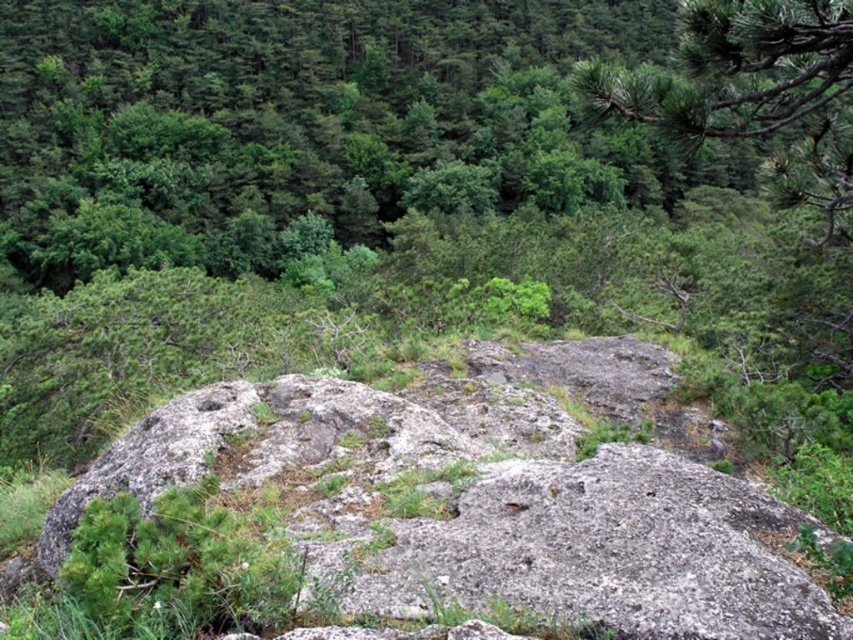
Question: Is gray rough rock at center wider than green needle-like at upper right?

Choices:
 (A) yes
 (B) no

Answer: (B)

Question: Does gray rough rock at center appear under green needle-like at upper right?

Choices:
 (A) no
 (B) yes

Answer: (B)

Question: Considering the relative positions of gray rough rock at center and green needle-like at upper right in the image provided, where is gray rough rock at center located with respect to green needle-like at upper right?

Choices:
 (A) left
 (B) right

Answer: (A)